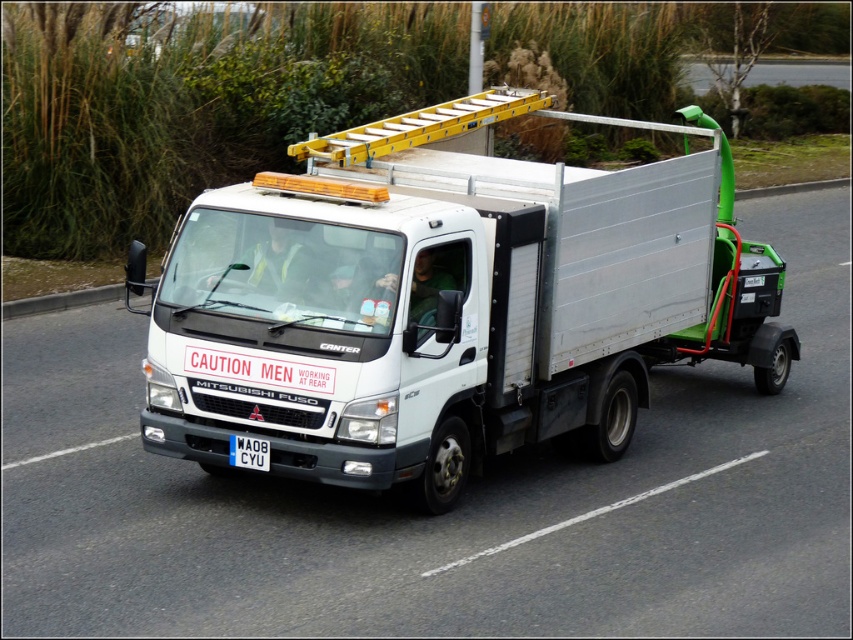
Is point (730, 253) behind point (447, 125)?

Yes, point (730, 253) is behind point (447, 125).

The width and height of the screenshot is (853, 640). I want to click on white metallic truck at center, so click(x=447, y=304).

How far apart are white metallic truck at center and blue plastic license plate at center?

white metallic truck at center and blue plastic license plate at center are 8.43 feet apart from each other.

Is point (374, 182) less distant than point (248, 445)?

That is False.

In order to click on white metallic truck at center in this screenshot , I will do `click(447, 304)`.

Is yellow metallic ladder at upper center wider than blue plastic license plate at center?

Yes.

Looking at this image, who is positioned more to the right, yellow metallic ladder at upper center or blue plastic license plate at center?

yellow metallic ladder at upper center

Describe the element at coordinates (421, 125) in the screenshot. This screenshot has width=853, height=640. I see `yellow metallic ladder at upper center` at that location.

Where is `yellow metallic ladder at upper center`? The image size is (853, 640). yellow metallic ladder at upper center is located at coordinates tap(421, 125).